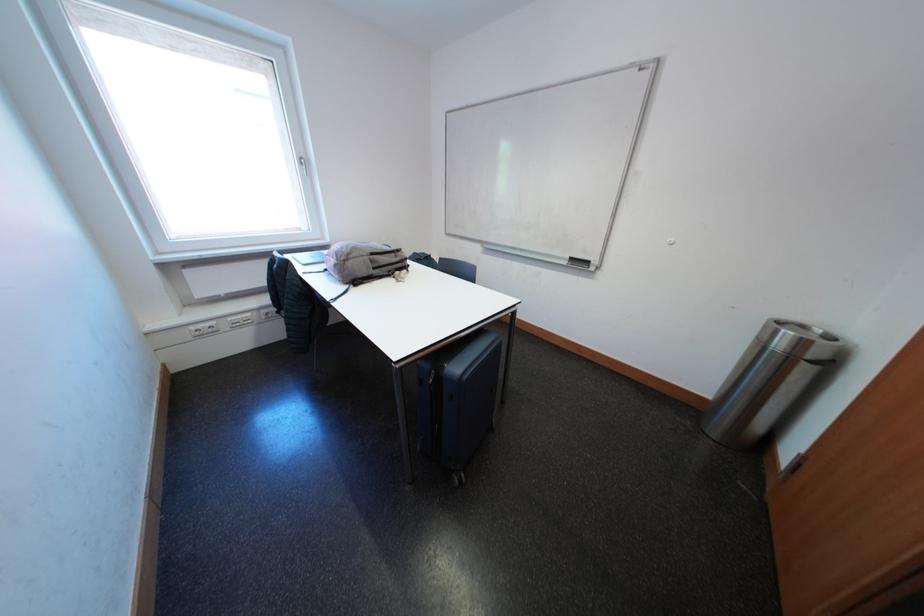
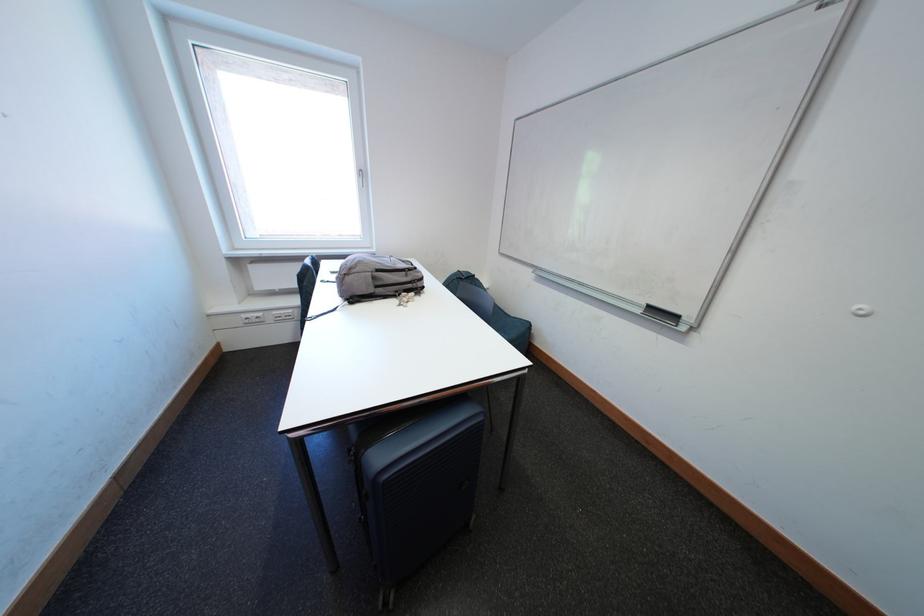
Where in the second image is the point corresponding to [398,275] from the first image?

(406, 294)